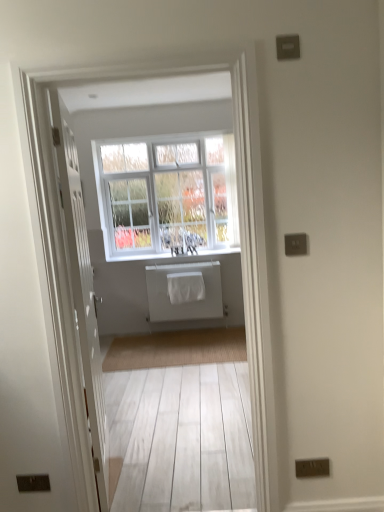
Where is `white painted wood at center`? This screenshot has height=512, width=384. white painted wood at center is located at coordinates (175, 255).

The image size is (384, 512). What do you see at coordinates (82, 289) in the screenshot? I see `white wooden door at center` at bounding box center [82, 289].

This screenshot has width=384, height=512. What are the coordinates of `white matte radiator at center` in the screenshot? It's located at (184, 291).

Does white wooden door at center contain white painted wood at center?

No, white painted wood at center is not surrounded by white wooden door at center.

Is white wooden door at center with white painted wood at center?

They are not placed beside each other.

From the picture: From a real-world perspective, is white wooden door at center positioned above or below white painted wood at center?

Clearly, from a real-world perspective, white wooden door at center is above white painted wood at center.

Is white wooden door at center further to the viewer compared to white painted wood at center?

No, white wooden door at center is in front of white painted wood at center.

Is white painted wood at center completely or partially inside white matte radiator at center?

Actually, white painted wood at center is outside white matte radiator at center.

Where is `appliance lying in front of the white painted wood at center`? The image size is (384, 512). appliance lying in front of the white painted wood at center is located at coordinates (184, 291).

Is white matte radiator at center far from white painted wood at center?

No.

Which object is further away from the camera taking this photo, white matte radiator at center or white painted wood at center?

white painted wood at center is behind.

Between point (187, 277) and point (101, 182), which one is positioned behind?

The point (101, 182) is more distant.

In terms of width, does white matte radiator at center look wider or thinner when compared to white textured window at center?

white matte radiator at center is thinner than white textured window at center.

Is white matte radiator at center far away from white textured window at center?

Actually, white matte radiator at center and white textured window at center are a little close together.

Is white matte radiator at center situated inside white textured window at center or outside?

white matte radiator at center exists outside the volume of white textured window at center.

From a real-world perspective, between white painted wood at center and white textured window at center, who is vertically lower?

white painted wood at center.

Who is smaller, white painted wood at center or white textured window at center?

Smaller between the two is white painted wood at center.

Is white painted wood at center at the left side of white textured window at center?

In fact, white painted wood at center is to the right of white textured window at center.

From the image's perspective, is white painted wood at center located above or below white textured window at center?

Clearly, from the image's perspective, white painted wood at center is below white textured window at center.

From the image's perspective, who appears lower, white painted wood at center or white wooden door at center?

white wooden door at center, from the image's perspective.

How distant is white painted wood at center from white wooden door at center?

A distance of 2.48 meters exists between white painted wood at center and white wooden door at center.

Can you confirm if white painted wood at center is bigger than white wooden door at center?

Actually, white painted wood at center might be smaller than white wooden door at center.

This screenshot has height=512, width=384. In the image, there is a white wooden door at center. In order to click on window sill above it (from the image's perspective) in this screenshot , I will do `click(175, 255)`.

Consider the image. Based on their positions, is white textured window at center located to the left or right of white wooden door at center?

Clearly, white textured window at center is on the right of white wooden door at center in the image.

In terms of width, does white textured window at center look wider or thinner when compared to white wooden door at center?

Clearly, white textured window at center has more width compared to white wooden door at center.

This screenshot has height=512, width=384. What are the coordinates of `window that is above the white wooden door at center (from the image's perspective)` in the screenshot? It's located at (168, 195).

Can we say white textured window at center lies outside white painted wood at center?

Yes, white textured window at center is located beyond the bounds of white painted wood at center.

Is white textured window at center aimed at white painted wood at center?

No, white textured window at center is not oriented towards white painted wood at center.

Is point (230, 239) positioned behind point (202, 260)?

Yes, it is behind point (202, 260).

Looking at this image, is the depth of white textured window at center less than that of white painted wood at center?

Yes, white textured window at center is closer to the camera.

This screenshot has height=512, width=384. In the image, there is a white wooden door at center. In order to click on window sill below it (from a real-world perspective) in this screenshot , I will do `click(175, 255)`.

At what (x,y) coordinates should I click in order to perform the action: click on appliance below the white painted wood at center (from the image's perspective). Please return your answer as a coordinate pair (x, y). The image size is (384, 512). Looking at the image, I should click on click(x=184, y=291).

Based on their spatial positions, is white painted wood at center or white wooden door at center closer to white textured window at center?

The object closer to white textured window at center is white painted wood at center.

Based on their spatial positions, is white matte radiator at center or white wooden door at center further from white painted wood at center?

Based on the image, white wooden door at center appears to be further to white painted wood at center.

Considering their positions, is white matte radiator at center positioned closer to white textured window at center than white wooden door at center?

white matte radiator at center is positioned closer to the anchor white textured window at center.

When comparing their distances from white wooden door at center, does white textured window at center or white painted wood at center seem further?

Based on the image, white textured window at center appears to be further to white wooden door at center.

Based on the photo, when comparing their distances from white painted wood at center, does white textured window at center or white matte radiator at center seem further?

Based on the image, white textured window at center appears to be further to white painted wood at center.

Looking at the image, which one is located closer to white matte radiator at center, white painted wood at center or white wooden door at center?

Based on the image, white painted wood at center appears to be nearer to white matte radiator at center.

When comparing their distances from white painted wood at center, does white textured window at center or white wooden door at center seem closer?

white textured window at center lies closer to white painted wood at center than the other object.

Looking at the image, which one is located closer to white matte radiator at center, white textured window at center or white wooden door at center?

white textured window at center.

This screenshot has height=512, width=384. In order to click on window sill between white textured window at center and white matte radiator at center in the up-down direction in this screenshot , I will do `click(175, 255)`.

Identify the location of appliance located between white wooden door at center and white painted wood at center in the depth direction. (184, 291).

Locate an element on the screen. This screenshot has height=512, width=384. window located between white wooden door at center and white matte radiator at center in the depth direction is located at coordinates (168, 195).

I want to click on window located between white wooden door at center and white painted wood at center in the depth direction, so click(168, 195).